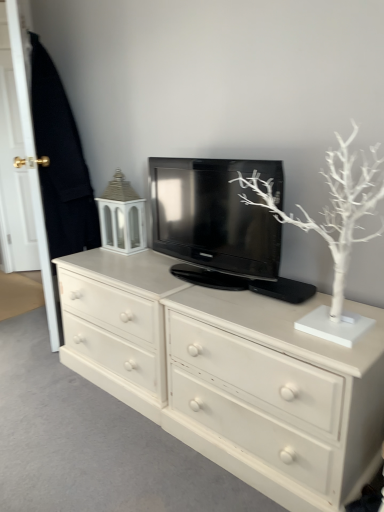
Identify the location of vacant space underneath white matte tree at upper right (from a real-world perspective). Image resolution: width=384 pixels, height=512 pixels. (321, 326).